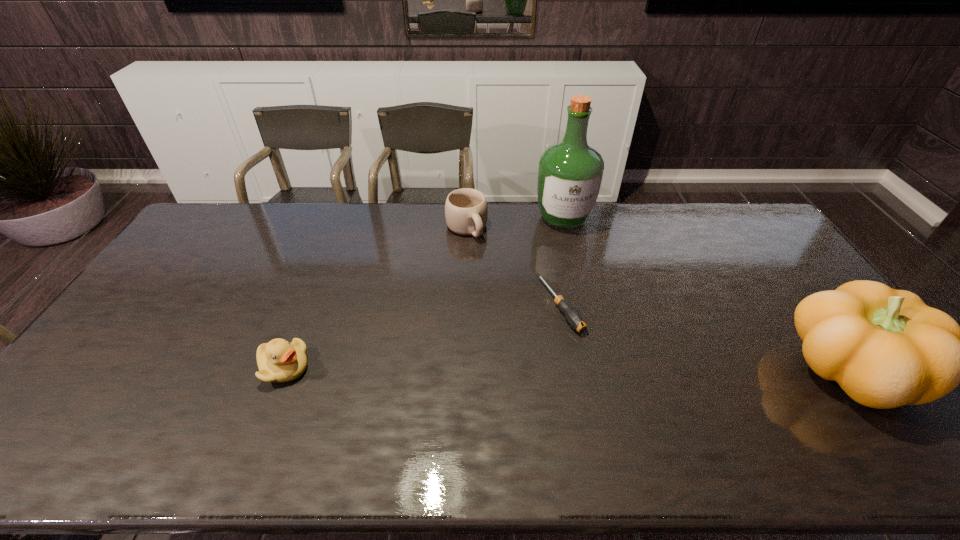
Where is `vacant position located at the tip of the shortest object`? Image resolution: width=960 pixels, height=540 pixels. vacant position located at the tip of the shortest object is located at coordinates (612, 382).

Locate an element on the screen. This screenshot has height=540, width=960. vacant space located on the side of the mug with the handle is located at coordinates (504, 281).

Identify the location of vacant region located 0.070m on the side of the mug with the handle. (484, 254).

Where is `vacant space situated on the side of the mug with the handle`? This screenshot has height=540, width=960. vacant space situated on the side of the mug with the handle is located at coordinates (529, 315).

The height and width of the screenshot is (540, 960). What are the coordinates of `vacant space situated 0.210m on the front-facing side of the liquor` in the screenshot? It's located at (579, 276).

I want to click on vacant area situated on the front-facing side of the liquor, so click(x=588, y=310).

You are a GUI agent. You are given a task and a screenshot of the screen. Output one action in this format:
    pyautogui.click(x=<x>, y=<y>)
    Task: Click on the free space located 0.270m on the front-facing side of the liquor
    
    Given the screenshot: What is the action you would take?
    pyautogui.click(x=582, y=289)

Identify the location of mug that is at the far edge. (466, 210).

Identify the location of liquor situated at the far edge. (570, 175).

Where is `duckling situated at the near edge`? Image resolution: width=960 pixels, height=540 pixels. duckling situated at the near edge is located at coordinates (278, 360).